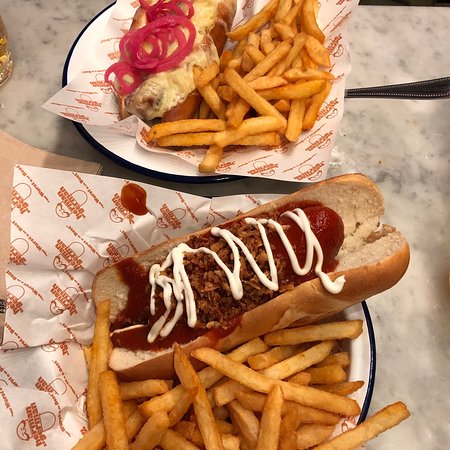
At what (x,y) coordinates should I click in order to perform the action: click on brown paper napkin (s). Please return your answer as a coordinate pair (x, y). Image resolution: width=450 pixels, height=450 pixels. Looking at the image, I should click on (17, 153).